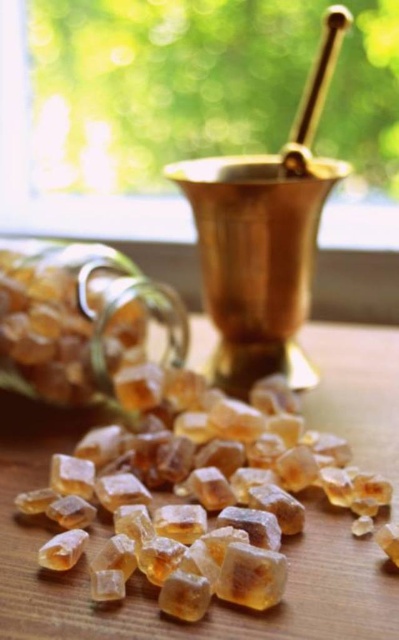
Question: In this image, where is translucent amber crystal at center located relative to gold metallic mortar at upper center?

Choices:
 (A) right
 (B) left

Answer: (B)

Question: Does translucent amber glass jar at lower left have a greater width compared to transparent glass window at upper center?

Choices:
 (A) no
 (B) yes

Answer: (A)

Question: Which point is closer to the camera?

Choices:
 (A) translucent amber crystal at center
 (B) gold metallic mortar at upper center

Answer: (A)

Question: Can you confirm if gold metallic mortar at upper center is smaller than translucent amber glass jar at lower left?

Choices:
 (A) no
 (B) yes

Answer: (A)

Question: Which of the following is the farthest from the observer?

Choices:
 (A) (264, 180)
 (B) (175, 349)

Answer: (B)

Question: Which object appears closest to the camera in this image?

Choices:
 (A) translucent amber crystal at center
 (B) transparent glass window at upper center

Answer: (A)